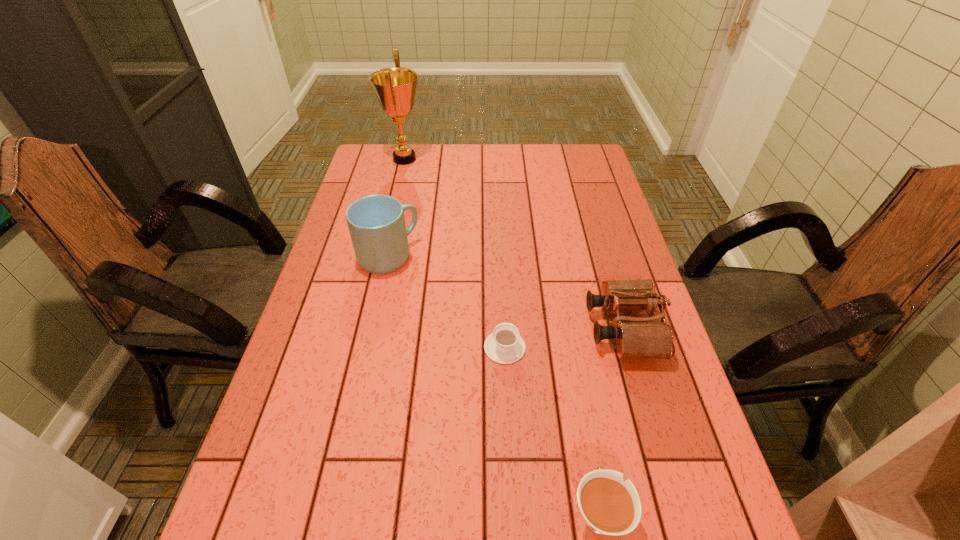
Identify the location of free space located through the eyepieces of the third shortest object. The image size is (960, 540). (464, 328).

Find the location of a particular element. free region located through the eyepieces of the third shortest object is located at coordinates (492, 328).

Where is `vacant space located 0.220m through the eyepieces of the third shortest object`? vacant space located 0.220m through the eyepieces of the third shortest object is located at coordinates (500, 328).

This screenshot has height=540, width=960. Find the location of `free spot located 0.380m on the handle side of the shortest object`. free spot located 0.380m on the handle side of the shortest object is located at coordinates (499, 233).

This screenshot has height=540, width=960. I want to click on vacant space located 0.390m on the handle side of the shortest object, so click(x=499, y=231).

In order to click on vacant position located 0.290m on the handle side of the shortest object in this screenshot , I will do `click(500, 253)`.

Find the location of a particular element. The height and width of the screenshot is (540, 960). object at the far edge is located at coordinates (395, 88).

Identify the location of award situated at the left edge. [395, 88].

At what (x,y) coordinates should I click in order to perform the action: click on mug that is at the left edge. Please return your answer as a coordinate pair (x, y). The image size is (960, 540). Looking at the image, I should click on pyautogui.click(x=376, y=223).

This screenshot has width=960, height=540. I want to click on object located in the right edge section of the desktop, so click(638, 337).